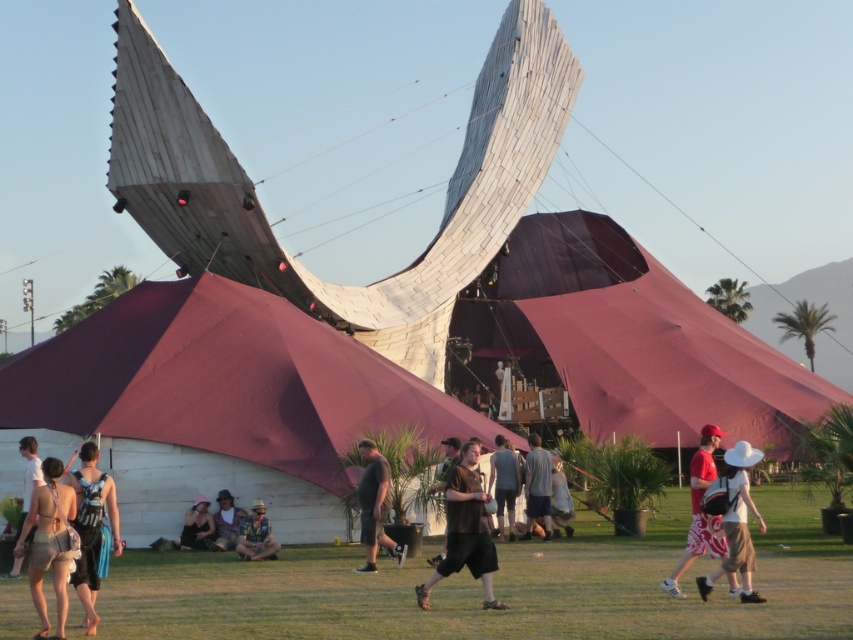
Is maroon fabric tent at center to the left of matte black tank top at lower left from the viewer's perspective?

In fact, maroon fabric tent at center is to the right of matte black tank top at lower left.

Does maroon fabric tent at center appear over matte black tank top at lower left?

Yes.

This screenshot has height=640, width=853. What do you see at coordinates (218, 404) in the screenshot?
I see `maroon fabric tent at center` at bounding box center [218, 404].

I want to click on maroon fabric tent at center, so click(218, 404).

Is point (231, 515) farther from camera compared to point (566, 529)?

No, it is in front of (566, 529).

Image resolution: width=853 pixels, height=640 pixels. What are the coordinates of `denim shorts at center` in the screenshot? It's located at (225, 522).

From the picture: Is white cotton shorts at center to the left of gray fabric shirt at center from the viewer's perspective?

Incorrect, white cotton shorts at center is not on the left side of gray fabric shirt at center.

Is white cotton shorts at center bigger than gray fabric shirt at center?

Indeed, white cotton shorts at center has a larger size compared to gray fabric shirt at center.

What do you see at coordinates (699, 512) in the screenshot?
I see `white cotton shorts at center` at bounding box center [699, 512].

This screenshot has width=853, height=640. What are the coordinates of `white cotton shorts at center` in the screenshot? It's located at (699, 512).